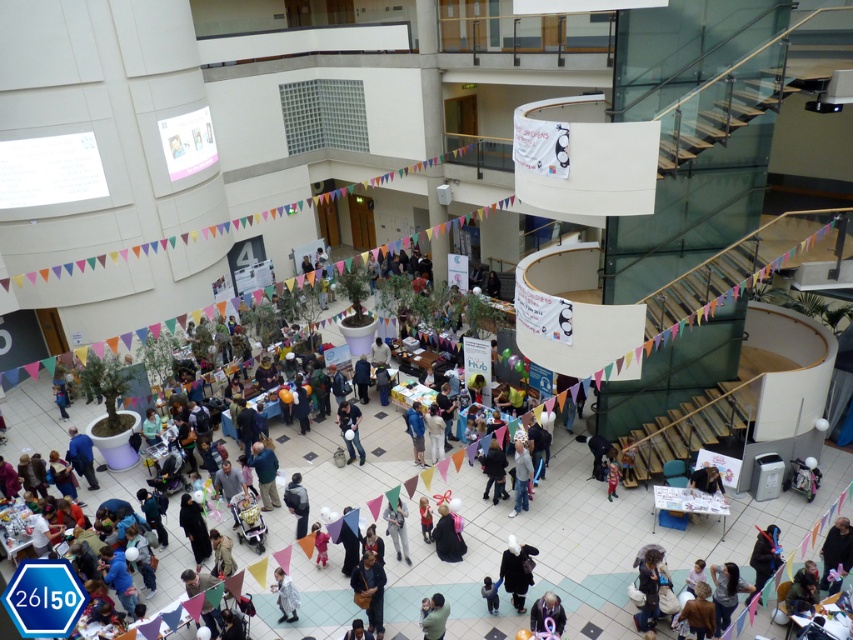
Question: Is the position of black fabric person at center less distant than that of white fluffy coat at center?

Choices:
 (A) yes
 (B) no

Answer: (B)

Question: Among these points, which one is nearest to the camera?

Choices:
 (A) (376, 580)
 (B) (451, 544)
 (C) (350, 448)

Answer: (A)

Question: Which of the following is the closest to the observer?

Choices:
 (A) (404, 513)
 (B) (427, 609)
 (C) (363, 451)
 (D) (370, 608)

Answer: (B)

Question: Does dark blue fabric bag at lower center have a lesser width compared to matte black jacket at center?

Choices:
 (A) no
 (B) yes

Answer: (B)

Question: Which of the following is the farthest from the observer?

Choices:
 (A) white fluffy coat at center
 (B) dark blue fabric bag at lower center

Answer: (B)

Question: Can you confirm if dark blue fabric bag at lower center is positioned above light brown fabric jacket at center?

Choices:
 (A) yes
 (B) no

Answer: (B)